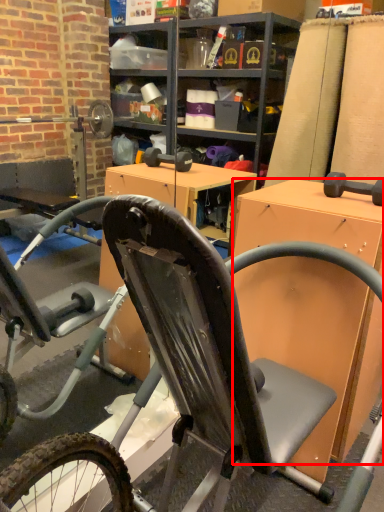
Question: From the image's perspective, where is desk (annotated by the red box) located in relation to bicycle in the image?

Choices:
 (A) above
 (B) below

Answer: (A)